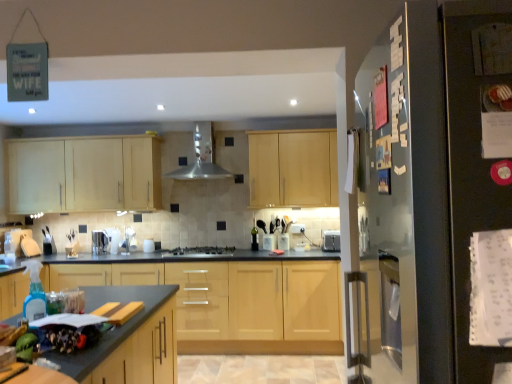
The width and height of the screenshot is (512, 384). What do you see at coordinates (239, 300) in the screenshot?
I see `light wood cabinet at center, which is the 1th cabinetry from bottom to top` at bounding box center [239, 300].

The height and width of the screenshot is (384, 512). What are the coordinates of `granite gray countertop at lower left` in the screenshot? It's located at (116, 328).

In order to face granite gray countertop at lower left, should I rotate leftwards or rightwards?

Turn left by 22.856 degrees to look at granite gray countertop at lower left.

What is the approximate width of light wood cabinet at center, which is the first cabinetry in top-to-bottom order?

It is 13.64 inches.

In order to face satin silver gas stove at center, should I rotate leftwards or rightwards?

Rotate left and turn 7.171 degrees.

The width and height of the screenshot is (512, 384). I want to click on light wood cabinet at center, marked as the 3th cabinetry in a top-to-bottom arrangement, so click(x=239, y=300).

Considering the sizes of objects granite gray countertop at lower left and light wood cabinet at center, marked as the 3th cabinetry in a top-to-bottom arrangement, in the image provided, who is taller, granite gray countertop at lower left or light wood cabinet at center, marked as the 3th cabinetry in a top-to-bottom arrangement,?

light wood cabinet at center, marked as the 3th cabinetry in a top-to-bottom arrangement, is taller.

Considering the relative positions of granite gray countertop at lower left and light wood cabinet at center, marked as the 3th cabinetry in a top-to-bottom arrangement, in the image provided, is granite gray countertop at lower left to the left of light wood cabinet at center, marked as the 3th cabinetry in a top-to-bottom arrangement, from the viewer's perspective?

Yes.

Is granite gray countertop at lower left far away from light wood cabinet at center, which is the 1th cabinetry from bottom to top?

Yes, granite gray countertop at lower left and light wood cabinet at center, which is the 1th cabinetry from bottom to top, are quite far apart.

Where is `countertop located in front of the light wood cabinet at center, marked as the 3th cabinetry in a top-to-bottom arrangement`? The width and height of the screenshot is (512, 384). countertop located in front of the light wood cabinet at center, marked as the 3th cabinetry in a top-to-bottom arrangement is located at coordinates (116, 328).

Between granite gray countertop at lower left and satin silver toaster at center, which is the 2th appliance in right-to-left order, which one has more height?

With more height is granite gray countertop at lower left.

Is granite gray countertop at lower left in front of or behind satin silver toaster at center, which ranks as the 1th appliance in left-to-right order, in the image?

granite gray countertop at lower left is in front of satin silver toaster at center, which ranks as the 1th appliance in left-to-right order.

Based on the photo, can you confirm if granite gray countertop at lower left is bigger than satin silver toaster at center, which is the 2th appliance in right-to-left order?

Indeed, granite gray countertop at lower left has a larger size compared to satin silver toaster at center, which is the 2th appliance in right-to-left order.

How far apart are satin silver exhaust hood at center and satin silver gas stove at center?

They are 35.43 inches apart.

Where is `exhaust hood behind the satin silver gas stove at center`? The image size is (512, 384). exhaust hood behind the satin silver gas stove at center is located at coordinates (201, 157).

From the image's perspective, is satin silver exhaust hood at center above or below satin silver gas stove at center?

Clearly, from the image's perspective, satin silver exhaust hood at center is above satin silver gas stove at center.

Which of these two, satin silver exhaust hood at center or satin silver gas stove at center, is smaller?

satin silver gas stove at center.

Is light wood cabinet at center, which is the 1th cabinetry from bottom to top, positioned with its back to satin silver toaster at center, acting as the 1th appliance starting from the right?

light wood cabinet at center, which is the 1th cabinetry from bottom to top, is not turned away from satin silver toaster at center, acting as the 1th appliance starting from the right.

How many degrees apart are the facing directions of light wood cabinet at center, marked as the 3th cabinetry in a top-to-bottom arrangement, and satin silver toaster at center, the 2th appliance in the left-to-right sequence?

light wood cabinet at center, marked as the 3th cabinetry in a top-to-bottom arrangement, and satin silver toaster at center, the 2th appliance in the left-to-right sequence, are facing 2.74 degrees away from each other.

Is the surface of light wood cabinet at center, which is the 1th cabinetry from bottom to top, in direct contact with satin silver toaster at center, the 2th appliance in the left-to-right sequence?

No, light wood cabinet at center, which is the 1th cabinetry from bottom to top, is not next to satin silver toaster at center, the 2th appliance in the left-to-right sequence.

Does light wood cabinet at center, marked as the 3th cabinetry in a top-to-bottom arrangement, appear on the left side of satin silver toaster at center, acting as the 1th appliance starting from the right?

Indeed, light wood cabinet at center, marked as the 3th cabinetry in a top-to-bottom arrangement, is positioned on the left side of satin silver toaster at center, acting as the 1th appliance starting from the right.

Looking at this image, considering the positions of objects satin silver gas stove at center and satin silver toaster at center, which ranks as the 1th appliance in left-to-right order, in the image provided, who is in front, satin silver gas stove at center or satin silver toaster at center, which ranks as the 1th appliance in left-to-right order,?

satin silver gas stove at center is in front.

Who is taller, satin silver gas stove at center or satin silver toaster at center, which is the 2th appliance in right-to-left order?

Standing taller between the two is satin silver toaster at center, which is the 2th appliance in right-to-left order.

From a real-world perspective, is satin silver gas stove at center under satin silver toaster at center, which is the 2th appliance in right-to-left order?

Yes, from a real-world perspective, satin silver gas stove at center is below satin silver toaster at center, which is the 2th appliance in right-to-left order.

From the image's perspective, is satin silver gas stove at center positioned above or below light wood cabinet at upper left, which appears as the second cabinetry when viewed from the top?

satin silver gas stove at center is situated lower than light wood cabinet at upper left, which appears as the second cabinetry when viewed from the top, in the image.

Which of these two, satin silver gas stove at center or light wood cabinet at upper left, positioned as the second cabinetry in bottom-to-top order, is thinner?

Thinner between the two is light wood cabinet at upper left, positioned as the second cabinetry in bottom-to-top order.

Choose the correct answer: Is satin silver gas stove at center inside light wood cabinet at upper left, positioned as the second cabinetry in bottom-to-top order, or outside it?

satin silver gas stove at center exists outside the volume of light wood cabinet at upper left, positioned as the second cabinetry in bottom-to-top order.

Considering the sizes of black matte refrigerator at right and light wood cabinet at center, which is the first cabinetry in top-to-bottom order, in the image, is black matte refrigerator at right wider or thinner than light wood cabinet at center, which is the first cabinetry in top-to-bottom order,?

Considering their sizes, black matte refrigerator at right looks broader than light wood cabinet at center, which is the first cabinetry in top-to-bottom order.

From a real-world perspective, is black matte refrigerator at right located beneath light wood cabinet at center, marked as the third cabinetry in a bottom-to-top arrangement?

Yes.

Could light wood cabinet at center, marked as the third cabinetry in a bottom-to-top arrangement, be considered to be inside black matte refrigerator at right?

Actually, light wood cabinet at center, marked as the third cabinetry in a bottom-to-top arrangement, is outside black matte refrigerator at right.

Is black matte refrigerator at right next to light wood cabinet at center, marked as the third cabinetry in a bottom-to-top arrangement?

No, black matte refrigerator at right is not with light wood cabinet at center, marked as the third cabinetry in a bottom-to-top arrangement.

Where is `the 1st cabinetry behind the granite gray countertop at lower left`? the 1st cabinetry behind the granite gray countertop at lower left is located at coordinates (239, 300).

In the image, there is a satin silver toaster at center, which is the 2th appliance in right-to-left order. Identify the location of countertop below it (from the image's perspective). coord(116,328).

When comparing their distances from black matte refrigerator at right, does granite gray countertop at lower left or light wood cabinet at center, marked as the 3th cabinetry in a top-to-bottom arrangement, seem further?

Based on the image, light wood cabinet at center, marked as the 3th cabinetry in a top-to-bottom arrangement, appears to be further to black matte refrigerator at right.

Looking at the image, which one is located closer to satin silver toaster at center, which is the 2th appliance in right-to-left order, light wood cabinet at center, marked as the third cabinetry in a bottom-to-top arrangement, or satin silver gas stove at center?

Based on the image, satin silver gas stove at center appears to be nearer to satin silver toaster at center, which is the 2th appliance in right-to-left order.

Looking at the image, which one is located further to light wood cabinet at center, which is the first cabinetry in top-to-bottom order, satin silver exhaust hood at center or satin silver toaster at center, which ranks as the 1th appliance in left-to-right order?

satin silver toaster at center, which ranks as the 1th appliance in left-to-right order, is positioned further to the anchor light wood cabinet at center, which is the first cabinetry in top-to-bottom order.

Which object lies further to the anchor point satin silver exhaust hood at center, satin silver toaster at center, acting as the 1th appliance starting from the right, or satin silver toaster at center, which ranks as the 1th appliance in left-to-right order?

satin silver toaster at center, acting as the 1th appliance starting from the right, is further to satin silver exhaust hood at center.

Estimate the real-world distances between objects in this image. Which object is further from satin silver exhaust hood at center, light wood cabinet at center, which is the 1th cabinetry from bottom to top, or light wood cabinet at upper left, which appears as the second cabinetry when viewed from the top?

light wood cabinet at center, which is the 1th cabinetry from bottom to top.

Considering their positions, is satin silver toaster at center, which ranks as the 1th appliance in left-to-right order, positioned closer to black matte refrigerator at right than satin silver toaster at center, acting as the 1th appliance starting from the right?

satin silver toaster at center, acting as the 1th appliance starting from the right, is closer to black matte refrigerator at right.

Based on their spatial positions, is satin silver gas stove at center or light wood cabinet at center, marked as the third cabinetry in a bottom-to-top arrangement, further from light wood cabinet at upper left, which appears as the second cabinetry when viewed from the top?

light wood cabinet at center, marked as the third cabinetry in a bottom-to-top arrangement, lies further to light wood cabinet at upper left, which appears as the second cabinetry when viewed from the top, than the other object.

Considering their positions, is satin silver toaster at center, which is the 2th appliance in right-to-left order, positioned closer to satin silver toaster at center, acting as the 1th appliance starting from the right, than black matte refrigerator at right?

satin silver toaster at center, which is the 2th appliance in right-to-left order, is positioned closer to the anchor satin silver toaster at center, acting as the 1th appliance starting from the right.

Find the location of `appliance situated between light wood cabinet at upper left, positioned as the second cabinetry in bottom-to-top order, and satin silver exhaust hood at center from left to right`. appliance situated between light wood cabinet at upper left, positioned as the second cabinetry in bottom-to-top order, and satin silver exhaust hood at center from left to right is located at coordinates (99, 242).

Identify the location of cabinetry positioned between black matte refrigerator at right and light wood cabinet at center, which is the first cabinetry in top-to-bottom order, from near to far. This screenshot has height=384, width=512. (239, 300).

Locate an element on the screen. The height and width of the screenshot is (384, 512). exhaust hood between satin silver toaster at center, which is the 2th appliance in right-to-left order, and satin silver toaster at center, the 2th appliance in the left-to-right sequence is located at coordinates (201, 157).

Find the location of a particular element. This screenshot has height=384, width=512. exhaust hood located between light wood cabinet at upper left, which appears as the second cabinetry when viewed from the top, and satin silver gas stove at center in the left-right direction is located at coordinates (201, 157).